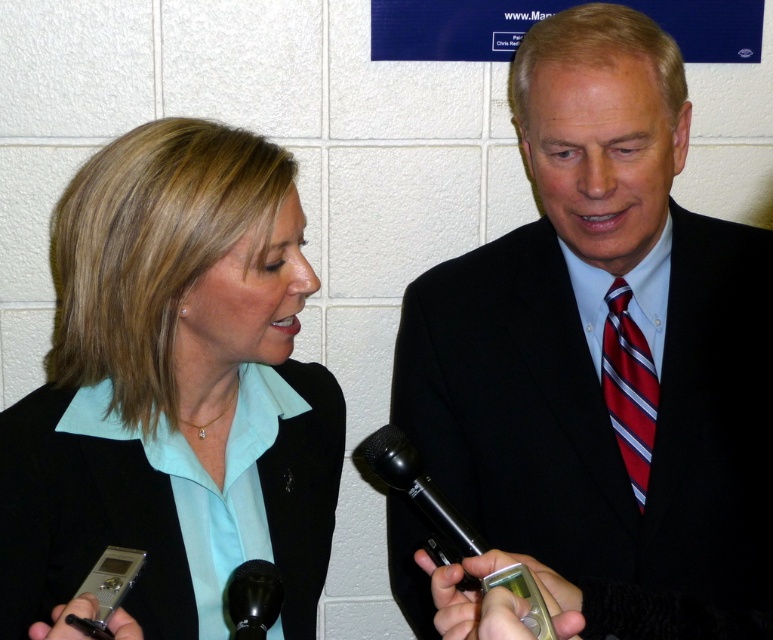
Can you confirm if matte black suit at center is bigger than red striped tie at right?

Yes.

Find the location of a particular element. The image size is (773, 640). matte black suit at center is located at coordinates (605, 353).

Is matte black suit at center in front of matte black blazer at left?

No, it is not.

Locate an element on the screen. This screenshot has height=640, width=773. matte black suit at center is located at coordinates (605, 353).

Is point (84, 608) less distant than point (254, 572)?

Yes, it is in front of point (254, 572).

Does matte black blazer at left appear on the left side of black matte microphone at lower center?

Correct, you'll find matte black blazer at left to the left of black matte microphone at lower center.

Where is `matte black blazer at left`? matte black blazer at left is located at coordinates (172, 394).

Locate an element on the screen. The height and width of the screenshot is (640, 773). matte black blazer at left is located at coordinates (172, 394).